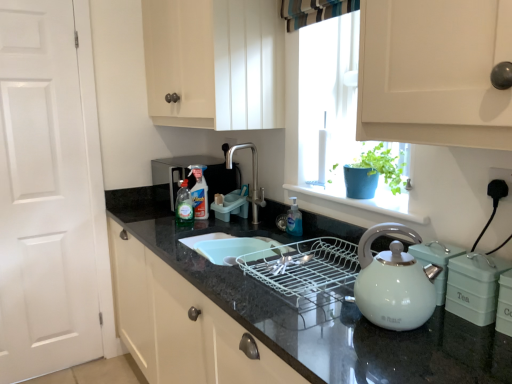
Question: Considering the positions of blue matte pot at window and translucent plastic bottle at center, the second bottle positioned from the back, in the image, is blue matte pot at window bigger or smaller than translucent plastic bottle at center, the second bottle positioned from the back,?

Choices:
 (A) small
 (B) big

Answer: (B)

Question: Would you say blue matte pot at window is to the left or to the right of translucent plastic bottle at center, which is the second bottle in front-to-back order, in the picture?

Choices:
 (A) left
 (B) right

Answer: (B)

Question: Estimate the real-world distances between objects in this image. Which object is closer to the striped fabric curtain at upper center?

Choices:
 (A) translucent plastic bottle at center, which is the second bottle in front-to-back order
 (B) black granite countertop at center
 (C) black plastic plug at lower right
 (D) green matte tea canister at right, which is counted as the 2th appliance, starting from the left
 (E) translucent plastic soap dispenser at center, which is the 3th bottle in back-to-front order

Answer: (E)

Question: Which of these objects is positioned farthest from the white matte door at left?

Choices:
 (A) translucent plastic soap dispenser at center, positioned as the 3th bottle in left-to-right order
 (B) polished stainless steel faucet at center
 (C) translucent plastic bottle at center, which is the second bottle in front-to-back order
 (D) black plastic plug at lower right
 (E) green matte tea canister at right, which is counted as the 2th appliance, starting from the left

Answer: (D)